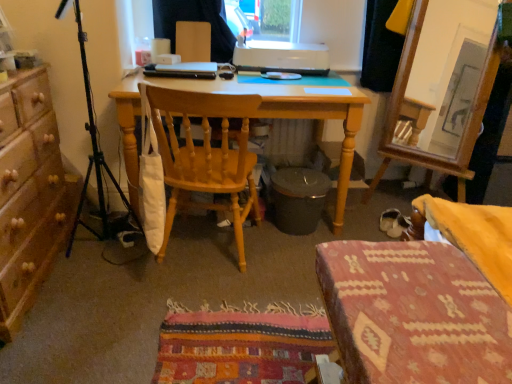
You are a GUI agent. You are given a task and a screenshot of the screen. Output one action in this format:
    pyautogui.click(x=<x>, y=<y>)
    Task: Click on the vacant space in between wooden chair at center and light wood desk at center
    This screenshot has width=512, height=384.
    Given the screenshot: What is the action you would take?
    tap(274, 254)